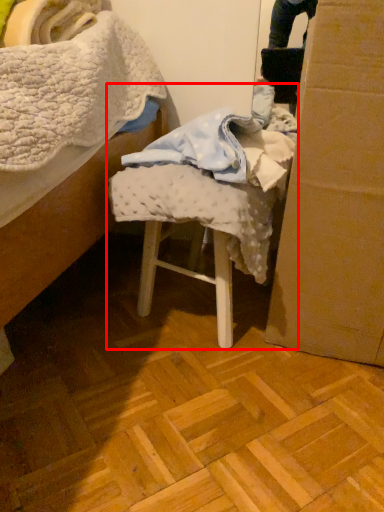
Question: Considering the relative positions of chair (annotated by the red box) and cardboard box in the image provided, where is chair (annotated by the red box) located with respect to the staircase?

Choices:
 (A) left
 (B) right

Answer: (A)